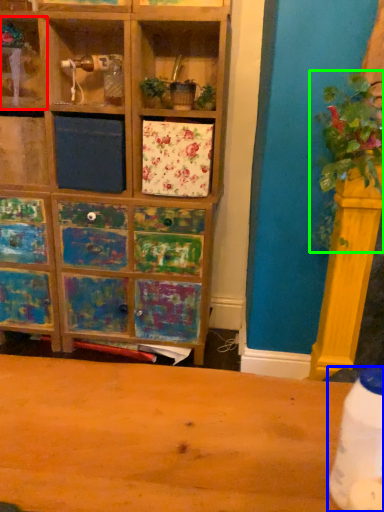
Question: Considering the real-world distances, which object is farthest from shelf (highlighted by a red box)? bottle (highlighted by a blue box) or floral arrangement (highlighted by a green box)?

Choices:
 (A) bottle
 (B) floral arrangement

Answer: (A)